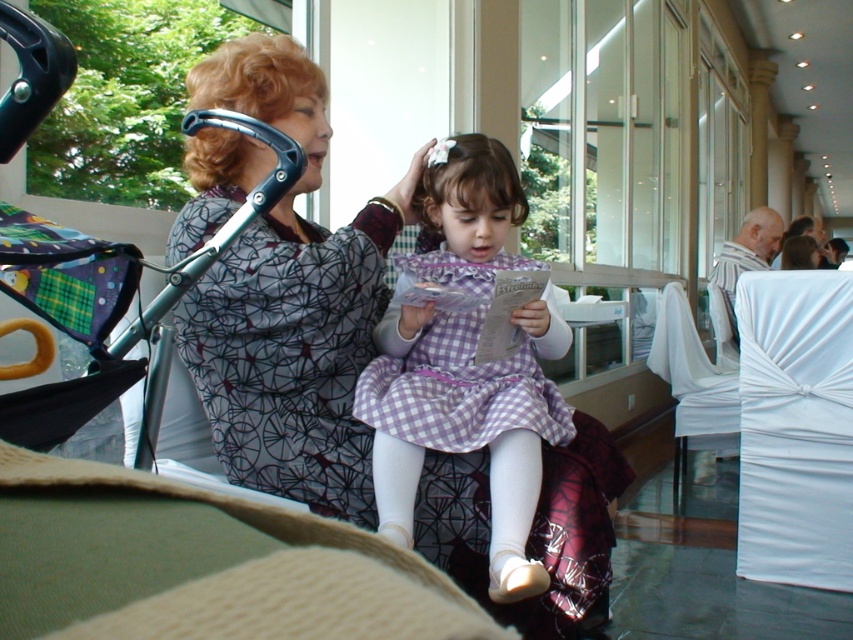
Question: From the image, what is the correct spatial relationship of checkered fabric dress at center in relation to white fabric-covered chair at right?

Choices:
 (A) above
 (B) below

Answer: (A)

Question: Estimate the real-world distances between objects in this image. Which object is closer to the purple checkered dress at center?

Choices:
 (A) checkered fabric dress at center
 (B) white fabric-covered chair at right

Answer: (A)

Question: Which point is closer to the camera?

Choices:
 (A) (585, 472)
 (B) (773, 413)

Answer: (A)

Question: Is the position of purple checkered dress at center more distant than that of white satin chair at right?

Choices:
 (A) yes
 (B) no

Answer: (B)

Question: Which point is farther to the camera?

Choices:
 (A) (471, 310)
 (B) (585, 598)

Answer: (A)

Question: Does checkered fabric dress at center appear on the left side of white satin chair at right?

Choices:
 (A) yes
 (B) no

Answer: (A)